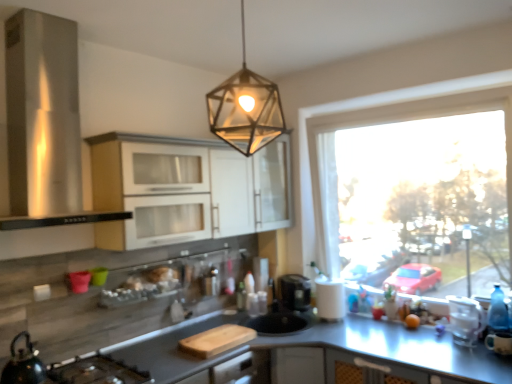
At what (x,y) coordinates should I click in order to perform the action: click on free space to the left of clear plastic container at right. Please return your answer as a coordinate pair (x, y). This screenshot has height=384, width=512. Looking at the image, I should click on (435, 347).